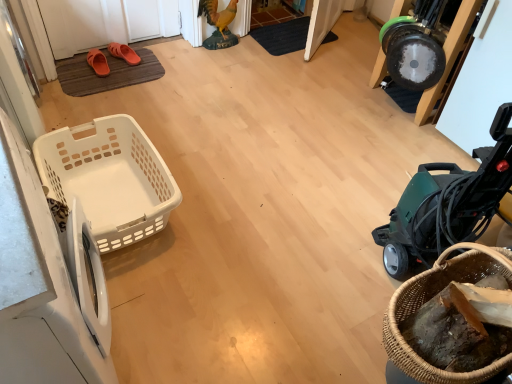
The image size is (512, 384). I want to click on vacant area that is situated to the right of black textured doormat at center, acting as the 1th doormat starting from the right, so click(349, 46).